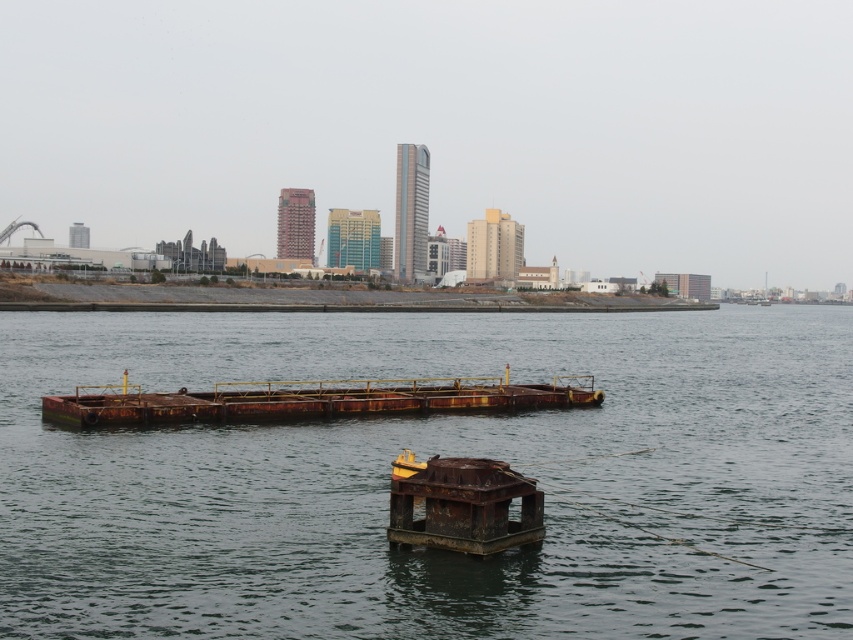
You are a delivery drone that needs to land on one of the two rusty metal structures in the scene. The drone requires a landing area that can accommodate its 3x3 meter landing pad. Given the sizes of the rusty metal barge at center and the rusty metal dock at center, which structure should you choose?

The rusty metal barge at center is bigger than the rusty metal dock at center, so the drone should choose the rusty metal barge at center for landing as it can accommodate the 3x3 meter landing pad.

You are standing on the shore looking at the waterfront scene. You see the rusty metal barge at center and the rusty metal dock at center. Which one is positioned closer to the city skyline in the background?

The rusty metal barge at center is located above the rusty metal dock at center, meaning it is closer to the city skyline in the background.

You are standing at the point marked by the coordinates point (426, 456) in the waterfront scene. What is the closest object to you in this location?

The point (426, 456) marks rusty metal water at center, so the closest object to you at this location is the rusty metal water at center.